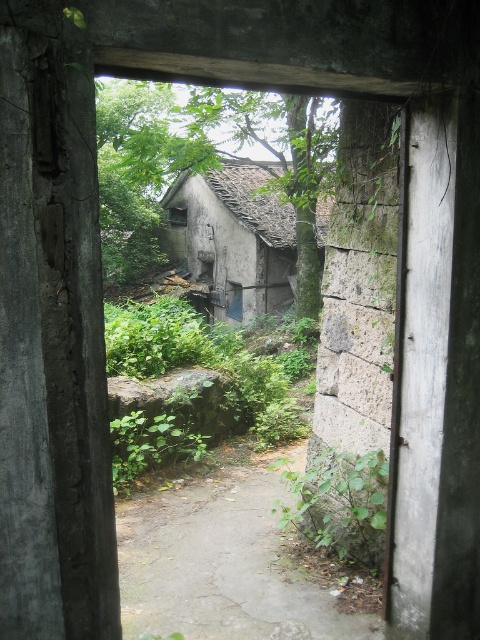
Does dull gray concrete path at center appear over weathered stone hut at center?

Actually, dull gray concrete path at center is below weathered stone hut at center.

At what (x,y) coordinates should I click in order to perform the action: click on dull gray concrete path at center. Please return your answer as a coordinate pair (x, y). This screenshot has height=640, width=480. Looking at the image, I should click on (233, 563).